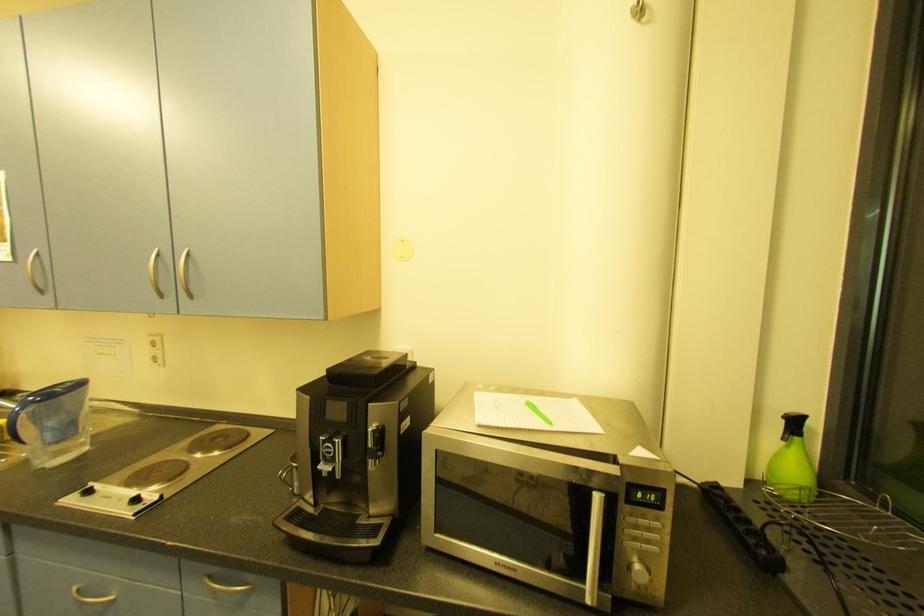
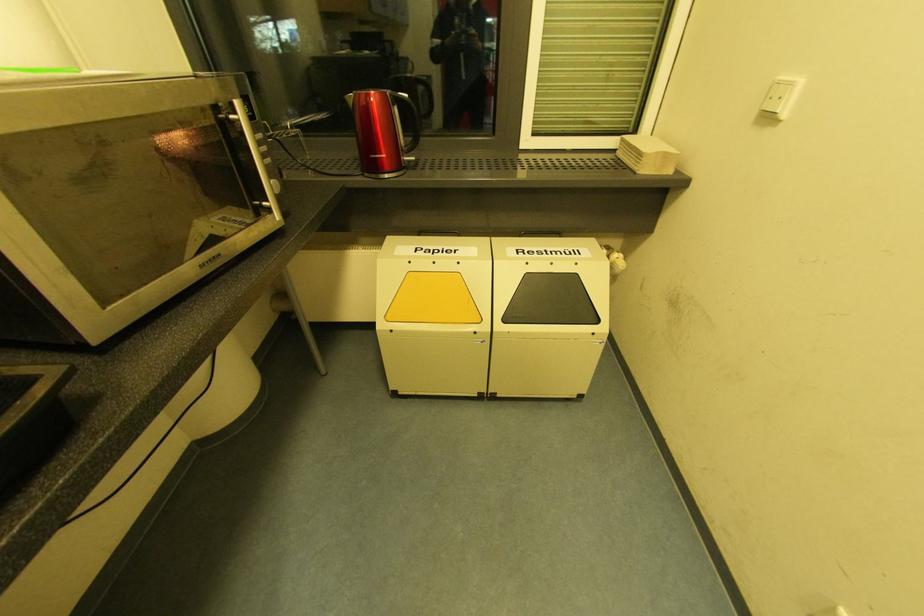
First-person continuous shooting, in which direction is the camera rotating?

The rotation direction of the camera is right-down.